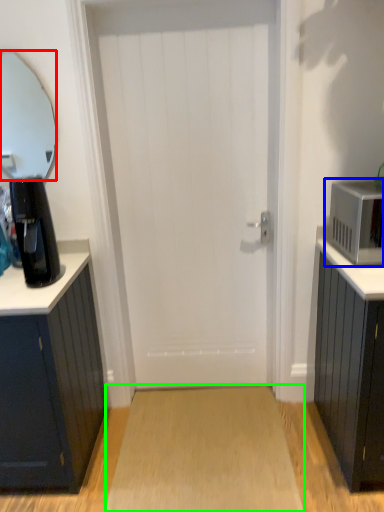
Question: Which object is positioned closest to mirror (highlighted by a red box)? Select from microwave oven (highlighted by a blue box) and plain (highlighted by a green box).

Choices:
 (A) microwave oven
 (B) plain

Answer: (B)